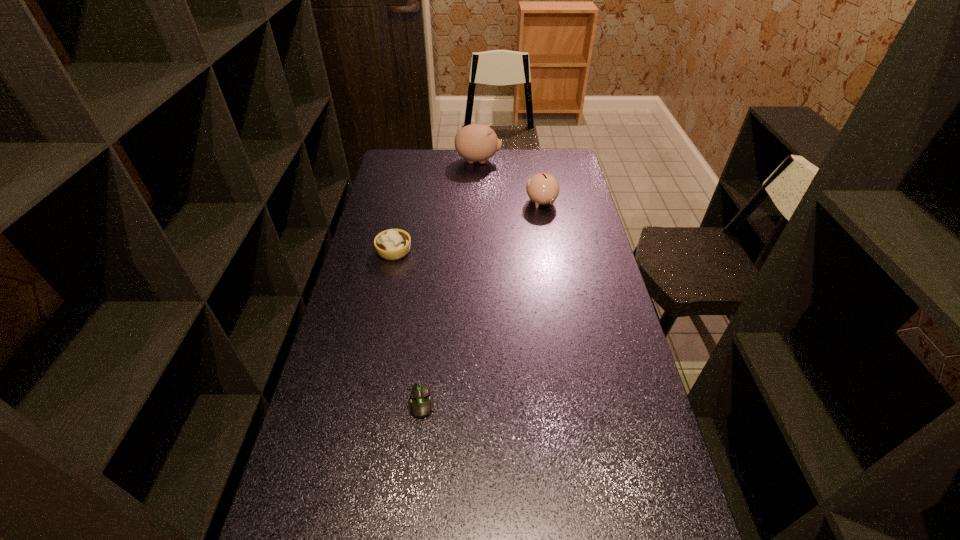
The height and width of the screenshot is (540, 960). I want to click on blank space located on the front of the whipped cream, so click(383, 304).

Identify the location of free space located on the back of the nearest object. The height and width of the screenshot is (540, 960). (433, 291).

Locate an element on the screen. object located at the far edge is located at coordinates (476, 142).

In order to click on object at the left edge in this screenshot , I will do `click(392, 244)`.

You are a GUI agent. You are given a task and a screenshot of the screen. Output one action in this format:
    pyautogui.click(x=<x>, y=<y>)
    Task: Click on the object that is at the right edge
    This screenshot has width=960, height=540.
    Given the screenshot: What is the action you would take?
    pyautogui.click(x=542, y=188)

Identify the location of vacant space at the left edge of the desktop. The height and width of the screenshot is (540, 960). (405, 188).

Where is `vacant space at the right edge of the desktop`? vacant space at the right edge of the desktop is located at coordinates (601, 254).

In the image, there is a desktop. Where is `vacant space at the far right corner`? vacant space at the far right corner is located at coordinates (563, 170).

Where is `vacant point located between the shorter piggy bank and the leftmost object`? The height and width of the screenshot is (540, 960). vacant point located between the shorter piggy bank and the leftmost object is located at coordinates (468, 227).

Locate an element on the screen. vacant space that's between the second nearest object and the second tallest object is located at coordinates (468, 227).